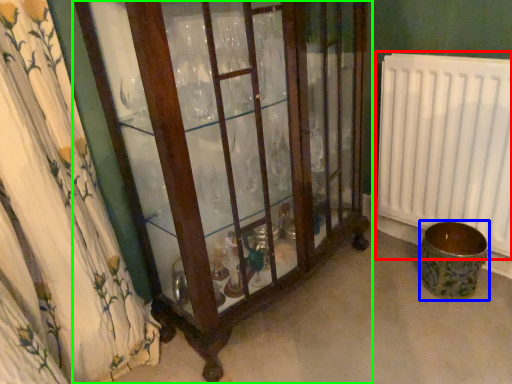
Question: Based on their relative distances, which object is nearer to radiator (highlighted by a red box)? Choose from toilet bowl (highlighted by a blue box) and furniture (highlighted by a green box).

Choices:
 (A) toilet bowl
 (B) furniture

Answer: (A)